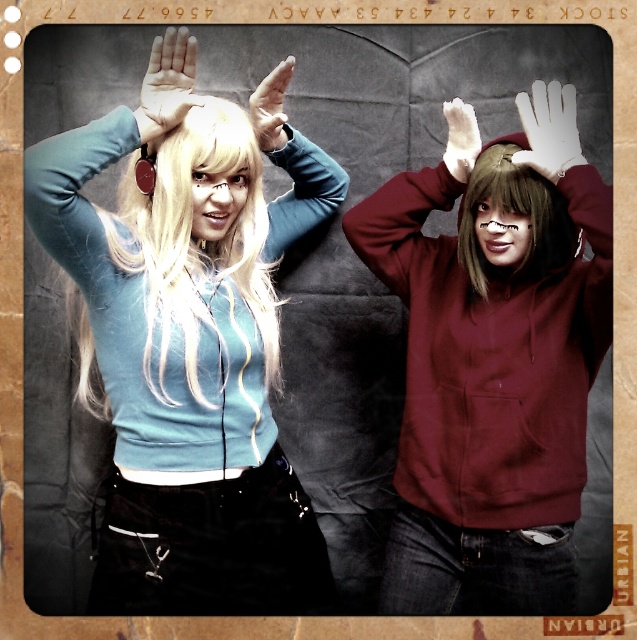
Question: Does dark brown straight hair at upper right appear on the left side of matte black hand at upper center?

Choices:
 (A) no
 (B) yes

Answer: (A)

Question: Among these points, which one is nearest to the camera?

Choices:
 (A) (213, 474)
 (B) (168, 60)
 (C) (275, 77)

Answer: (B)

Question: Can you confirm if blonde silky hair at left is positioned above white matte hand at upper center?

Choices:
 (A) yes
 (B) no

Answer: (B)

Question: Does matte black hand at upper center have a larger size compared to white matte hand at upper center?

Choices:
 (A) no
 (B) yes

Answer: (B)

Question: Which of the following is the farthest from the observer?

Choices:
 (A) matte black hand at upper center
 (B) matte maroon hoodie at center
 (C) matte blue hoodie at center

Answer: (A)

Question: Which object is closer to the camera taking this photo?

Choices:
 (A) white matte hand at upper center
 (B) matte maroon hoodie at center
 (C) dark brown straight hair at upper right

Answer: (B)